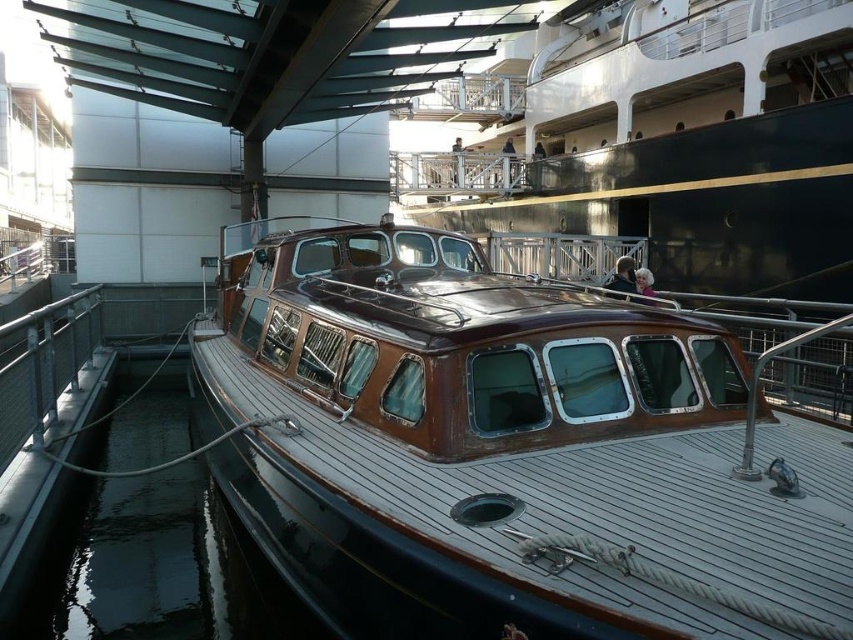
You are a delivery drone with a wingspan of 1.5 meters. You need to fly from the wooden boat at center to the black glossy water at lower left. Is there enough space between them for your drone to pass through without touching either?

The wooden boat at center and black glossy water at lower left are 6.70 meters apart, so yes, the drone can pass through the space between them since the distance is much larger than the drone wingspan of 1.5 meters.

You are standing on the dock and see the wooden boat at center and the black glossy water at lower left. Which object is taller?

The wooden boat at center is taller than the black glossy water at lower left.

Based on the photo, you are a photographer planning to take a photo of the wooden boat at center and the black glossy water at lower left. Since you want to highlight both subjects equally, which one should you zoom in on more to ensure they appear the same size in the final image?

The wooden boat at center is larger in size than the black glossy water at lower left. To make them appear the same size in the photo, you should zoom in more on the black glossy water at lower left and zoom out slightly on the wooden boat at center.